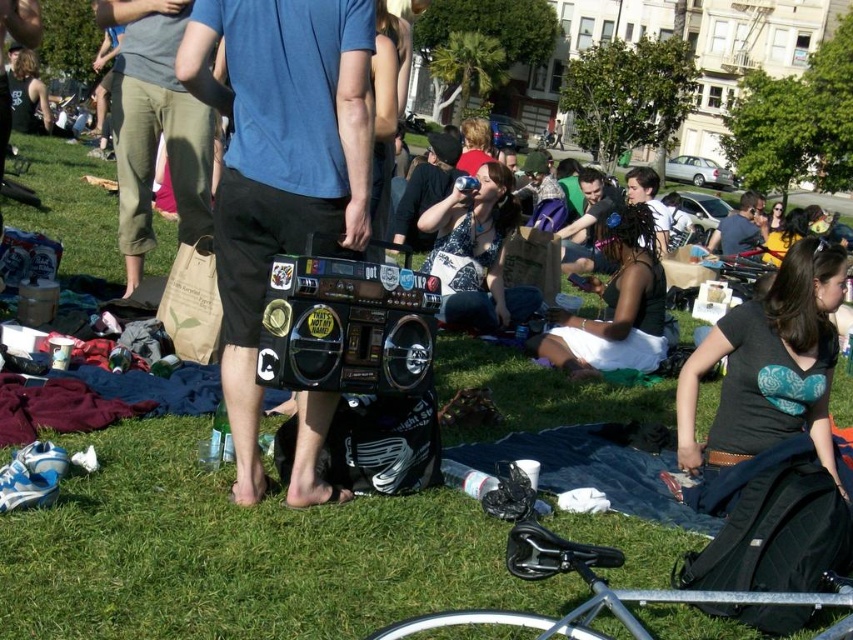
You are at a park and see the shiny black boombox at center and the white lace dress at center. Which object is shorter?

The shiny black boombox at center is shorter than the white lace dress at center.

You are organizing a small outdoor concert and need to place the matte black boombox at center and the matte black tank top at center on a table. If the table can only accommodate items with a width of 40 cm or less, which item might not fit based on their widths?

The matte black tank top at center might not fit on the table since its width is greater than the matte black boombox at center, which is under 40 cm. However, without knowing the exact width of the tank top, we can only infer it exceeds the boombox but cannot confirm if it surpasses 40 cm. The boombox is definitely under 40 cm, but the tank top could be over.

Consider the image. You are a photographer standing at the camera position. You want to take a closeup photo of the shiny black boombox at center. Can you estimate how far you need to walk towards it to get a clear closeup shot?

The shiny black boombox at center is 11.05 meters away from the camera. To get a clear closeup shot, you would need to move closer to reduce the distance, but the exact distance required depends on your camera lens specifications. However, the current distance is 11.05 meters.